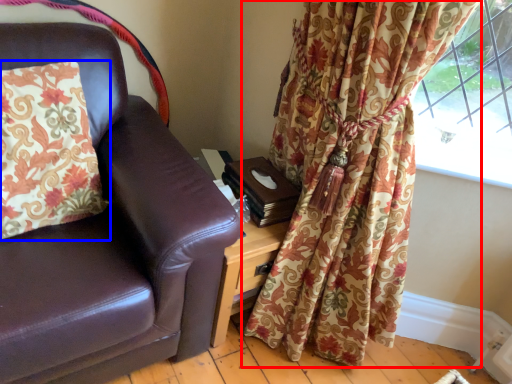
Question: Which of the following is the closest to the observer, curtain (highlighted by a red box) or pillow (highlighted by a blue box)?

Choices:
 (A) curtain
 (B) pillow

Answer: (A)